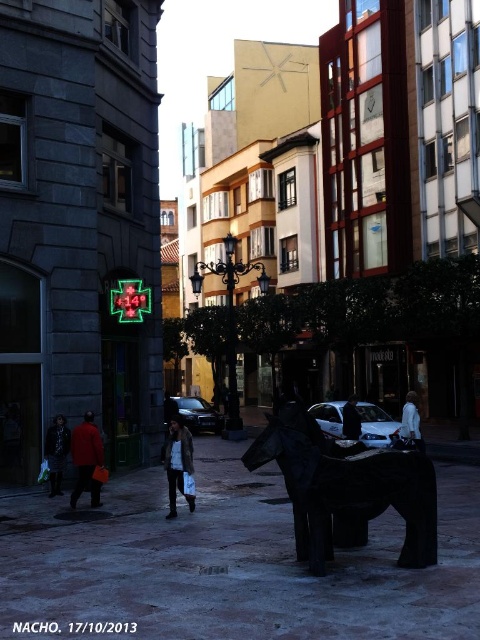
Question: Can you confirm if leather jacket at center is positioned to the right of white matte coat at lower right?

Choices:
 (A) yes
 (B) no

Answer: (B)

Question: Can you confirm if leather jacket at center is smaller than dark blue leather jacket at center?

Choices:
 (A) yes
 (B) no

Answer: (A)

Question: Can you confirm if white matte coat at lower right is positioned above dark blue leather jacket at center?

Choices:
 (A) no
 (B) yes

Answer: (B)

Question: Which point is farther to the camera?

Choices:
 (A) (416, 403)
 (B) (58, 417)
 (C) (180, 490)
 (D) (93, 486)

Answer: (A)

Question: Among these points, which one is nearest to the camera?

Choices:
 (A) (192, 451)
 (B) (408, 404)
 (C) (60, 456)

Answer: (A)

Question: Which object is positioned closest to the white matte coat at lower right?

Choices:
 (A) matte red coat at lower left
 (B) dark brown leather jacket at lower left

Answer: (A)